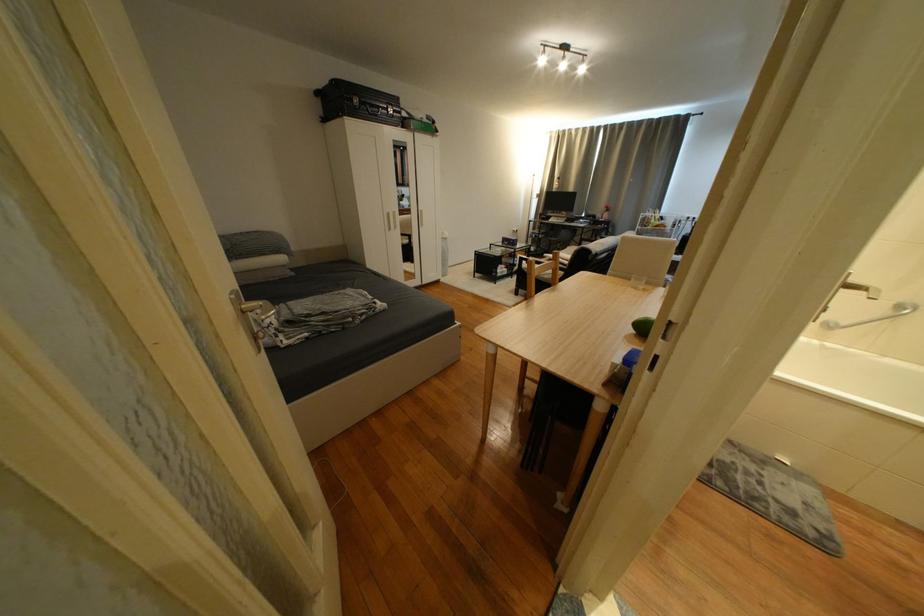
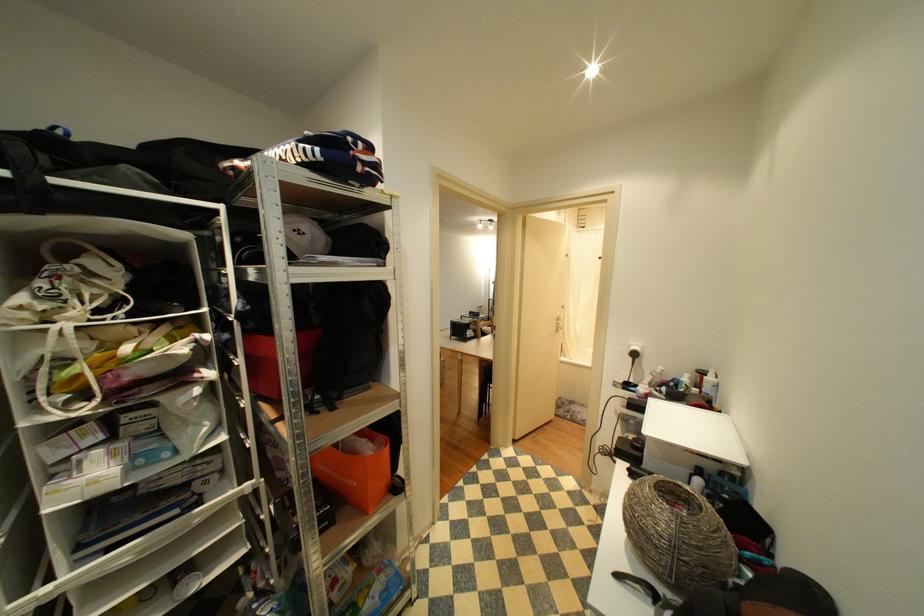
Question: What movement of the cameraman would produce the second image?

Choices:
 (A) Left
 (B) Right
 (C) Forward
 (D) Backward

Answer: (D)